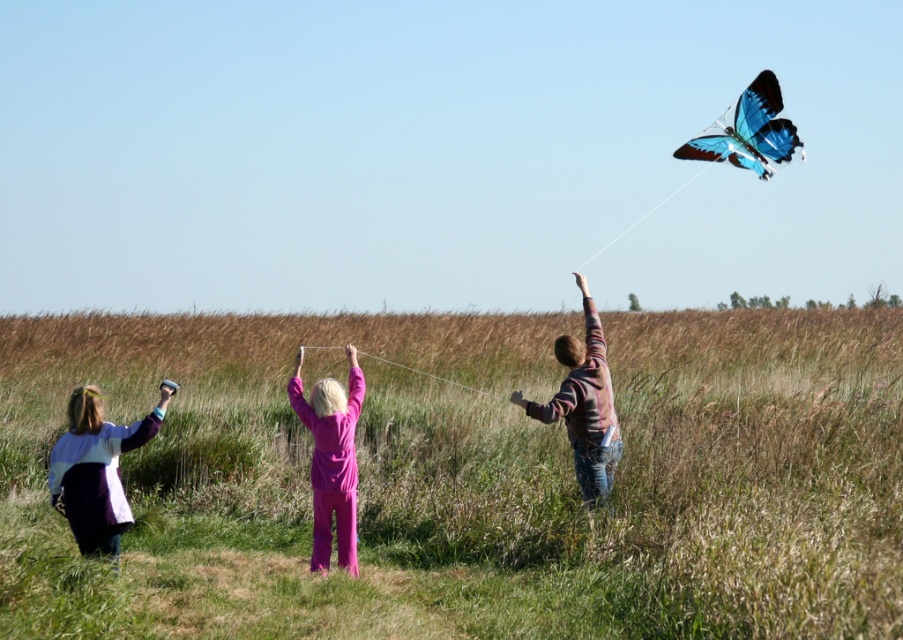
Can you confirm if purple matte pants at center is positioned above blue glossy butterfly at upper right?

Actually, purple matte pants at center is below blue glossy butterfly at upper right.

Is purple matte pants at center positioned at the back of blue glossy butterfly at upper right?

No, it is not.

Is point (290, 385) positioned before point (761, 125)?

Yes, point (290, 385) is in front of point (761, 125).

Find the location of a particular element. purple matte pants at center is located at coordinates (331, 460).

Is striped sweater at center wider than blue glossy butterfly at upper right?

Incorrect, striped sweater at center's width does not surpass blue glossy butterfly at upper right's.

Who is more distant from viewer, [600,337] or [762,136]?

Positioned behind is point [762,136].

The height and width of the screenshot is (640, 903). Identify the location of striped sweater at center. (584, 404).

Consider the image. Measure the distance between point (163, 387) and camera.

Point (163, 387) is 28.70 feet away from camera.

Can you confirm if white cotton shirt at lower left is positioned to the left of blue glossy butterfly at upper right?

Yes, white cotton shirt at lower left is to the left of blue glossy butterfly at upper right.

Where is `white cotton shirt at lower left`? The height and width of the screenshot is (640, 903). white cotton shirt at lower left is located at coordinates (96, 468).